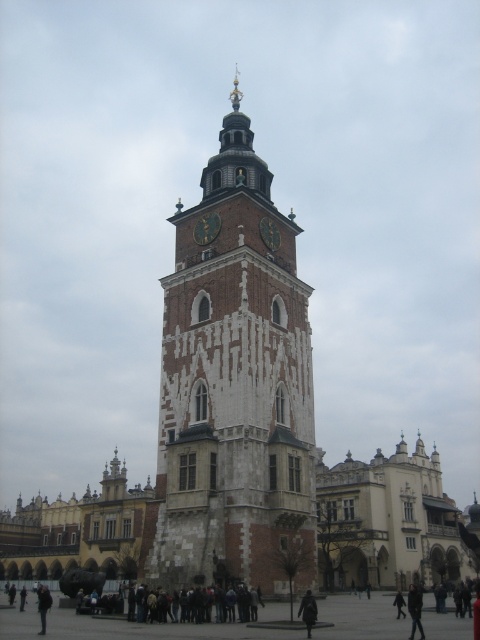
You are an architect visiting the historic square and notice the brown stone clock tower at center and the dark brown wooden clock at center. Which of these two structures is bigger in size?

The brown stone clock tower at center is larger in size than the dark brown wooden clock at center.

You are standing in the public square and want to take a closer look at the dark brown wooden clock at center. If you walk towards it at a speed of 1.5 meters per second, how many seconds will it take you to reach the clock?

The dark brown wooden clock at center is 61.33 meters away from the viewer. Walking at 1.5 meters per second, it would take approximately 40.89 seconds to reach it. Since you can round to the nearest whole number, it would take about 41 seconds.